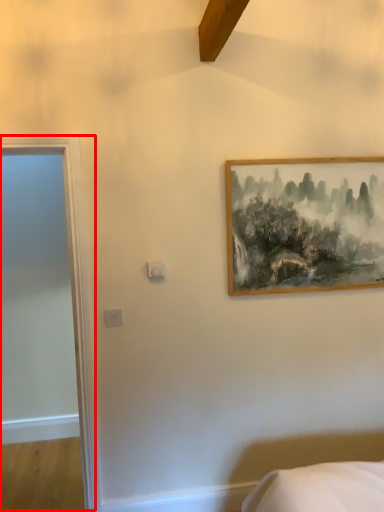
Question: Where is door (annotated by the red box) located in relation to picture frame in the image?

Choices:
 (A) left
 (B) right

Answer: (A)